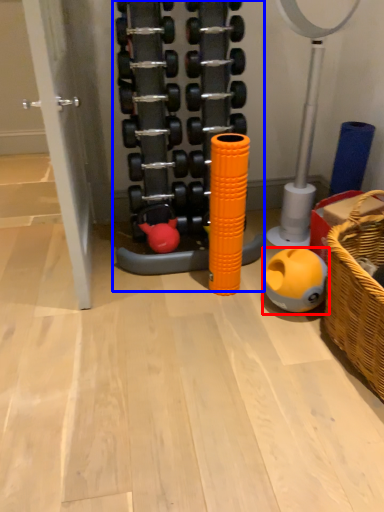
Question: Among these objects, which one is farthest to the camera, toy (highlighted by a red box) or toy (highlighted by a blue box)?

Choices:
 (A) toy
 (B) toy

Answer: (A)